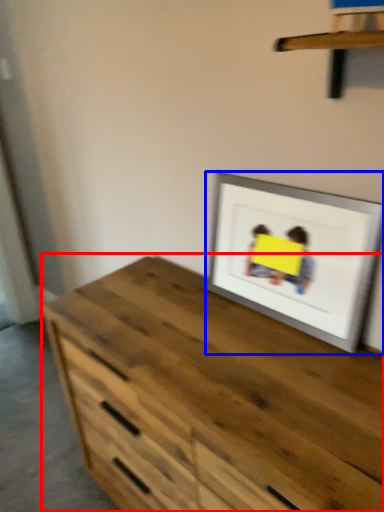
Question: Which point is closer to the camera, chest of drawers (highlighted by a red box) or picture frame (highlighted by a blue box)?

Choices:
 (A) chest of drawers
 (B) picture frame

Answer: (A)